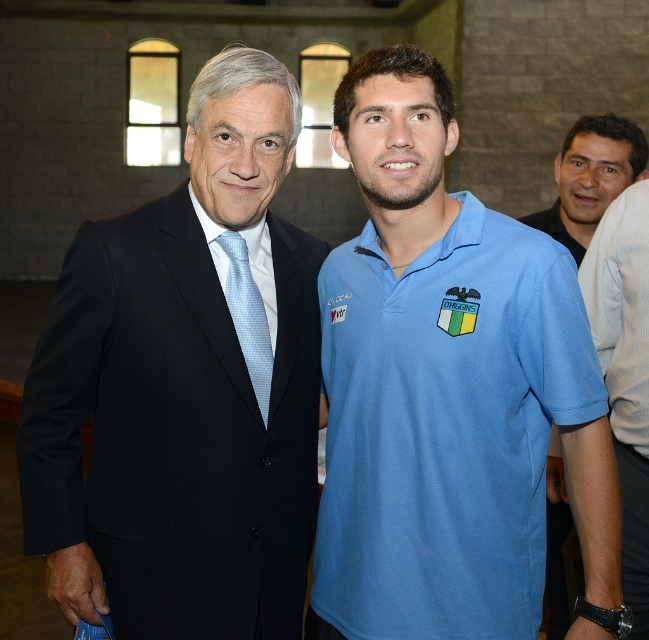
You are organizing a charity event and need to determine which of the two attendees is wearing a larger clothing item. The attendees are the person in the matte black suit at left and the person in the blue cotton polo shirt at center. Which one has the larger clothing item?

The matte black suit at left is bigger than the blue cotton polo shirt at center, so the person in the matte black suit at left is wearing the larger clothing item.

You are a photographer standing at the back of the room. You need to take a photo of both the matte black suit at left and the blue cotton polo shirt at center. The minimum distance between the two subjects for a clear shot is 8 feet. Can you capture them both clearly in one frame?

The matte black suit at left is 7.19 feet away from the blue cotton polo shirt at center, which is less than the required 8 feet. Therefore, you cannot capture both clearly in one frame.

You are attending a formal event and notice two shirts displayed on mannequins. The blue fabric shirt at right and the smooth black shirt at right are both available. If you want to choose the taller one, which shirt should you pick?

The blue fabric shirt at right has a greater height compared to the smooth black shirt at right, so you should choose the blue fabric shirt at right.